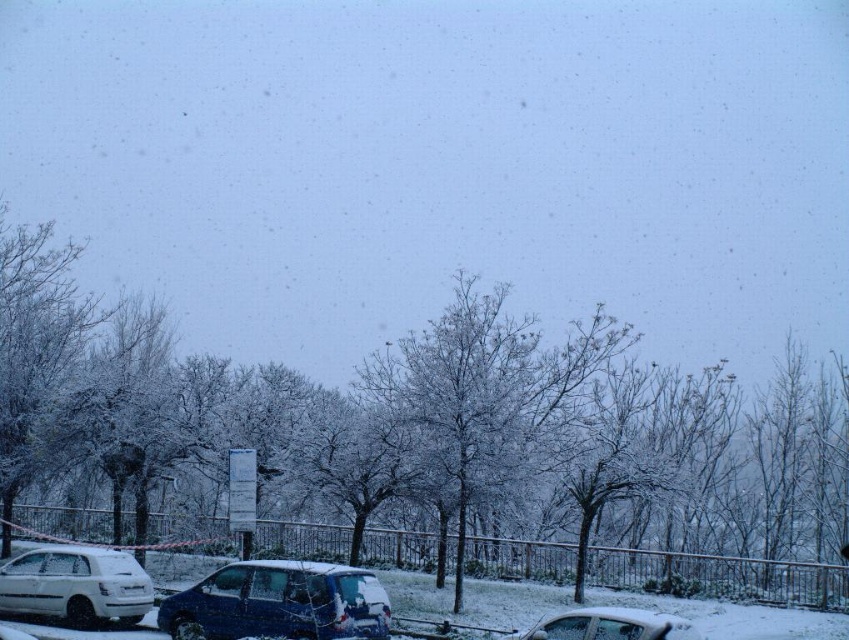
What do you see at coordinates (279, 602) in the screenshot? I see `sleek metallic van at center` at bounding box center [279, 602].

Does sleek metallic van at center have a smaller size compared to white matte hatchback at lower left?

No, sleek metallic van at center is not smaller than white matte hatchback at lower left.

Measure the distance between point (187,632) and camera.

Point (187,632) is 20.99 meters from camera.

Identify the location of sleek metallic van at center. (279, 602).

Does white matte hatchback at lower left appear on the right side of white matte car at lower center?

In fact, white matte hatchback at lower left is to the left of white matte car at lower center.

Between white matte hatchback at lower left and white matte car at lower center, which one is positioned lower?

white matte hatchback at lower left is below.

Is point (105, 573) positioned in front of point (544, 621)?

That is False.

I want to click on white matte hatchback at lower left, so click(x=76, y=584).

Who is more distant from viewer, (356,621) or (599,634)?

The point (356,621) is more distant.

Locate an element on the screen. sleek metallic van at center is located at coordinates (279, 602).